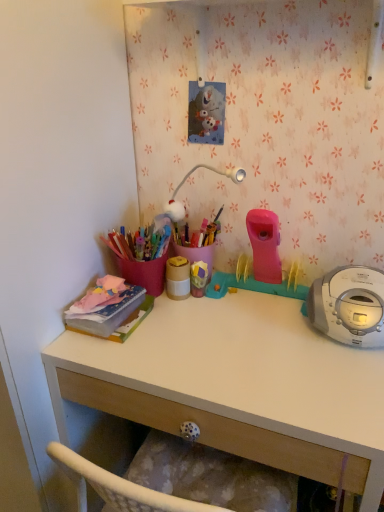
Question: Does white matte desk at center have a smaller size compared to matte pink notebook at left, marked as the 1th office supplies in a left-to-right arrangement?

Choices:
 (A) yes
 (B) no

Answer: (B)

Question: Is matte pink notebook at left, which is counted as the 2th office supplies, starting from the right, surrounded by white matte desk at center?

Choices:
 (A) yes
 (B) no

Answer: (B)

Question: Is white matte desk at center behind matte pink notebook at left, marked as the 1th office supplies in a left-to-right arrangement?

Choices:
 (A) yes
 (B) no

Answer: (B)

Question: Is matte pink notebook at left, which is counted as the 2th office supplies, starting from the right, at the back of white matte desk at center?

Choices:
 (A) yes
 (B) no

Answer: (B)

Question: Does white matte desk at center have a greater height compared to matte pink notebook at left, which is counted as the 2th office supplies, starting from the right?

Choices:
 (A) yes
 (B) no

Answer: (A)

Question: In terms of size, does matte gold container at center, which is the 1th office supplies from right to left, appear bigger or smaller than matte pink notebook at left, marked as the 1th office supplies in a left-to-right arrangement?

Choices:
 (A) big
 (B) small

Answer: (B)

Question: Considering the positions of point (168, 267) and point (87, 330), is point (168, 267) closer or farther from the camera than point (87, 330)?

Choices:
 (A) closer
 (B) farther

Answer: (B)

Question: In terms of height, does matte gold container at center, which is the 1th office supplies from right to left, look taller or shorter compared to matte pink notebook at left, which is counted as the 2th office supplies, starting from the right?

Choices:
 (A) short
 (B) tall

Answer: (B)

Question: Considering the relative positions of matte gold container at center, the 2th office supplies when ordered from left to right, and matte pink notebook at left, marked as the 1th office supplies in a left-to-right arrangement, in the image provided, is matte gold container at center, the 2th office supplies when ordered from left to right, to the left or to the right of matte pink notebook at left, marked as the 1th office supplies in a left-to-right arrangement,?

Choices:
 (A) right
 (B) left

Answer: (A)

Question: In terms of height, does matte pink notebook at left, marked as the 1th office supplies in a left-to-right arrangement, look taller or shorter compared to matte gold container at center, which is the 1th office supplies from right to left?

Choices:
 (A) tall
 (B) short

Answer: (B)

Question: Is matte pink notebook at left, marked as the 1th office supplies in a left-to-right arrangement, wider or thinner than matte gold container at center, which is the 1th office supplies from right to left?

Choices:
 (A) wide
 (B) thin

Answer: (A)

Question: In the image, is matte pink notebook at left, marked as the 1th office supplies in a left-to-right arrangement, on the left side or the right side of matte gold container at center, which is the 1th office supplies from right to left?

Choices:
 (A) left
 (B) right

Answer: (A)

Question: From the image's perspective, is matte pink notebook at left, marked as the 1th office supplies in a left-to-right arrangement, above or below matte gold container at center, which is the 1th office supplies from right to left?

Choices:
 (A) above
 (B) below

Answer: (B)

Question: Is matte gold container at center, which is the 1th office supplies from right to left, bigger or smaller than white matte desk at center?

Choices:
 (A) small
 (B) big

Answer: (A)

Question: From a real-world perspective, relative to white matte desk at center, is matte gold container at center, which is the 1th office supplies from right to left, vertically above or below?

Choices:
 (A) above
 (B) below

Answer: (A)